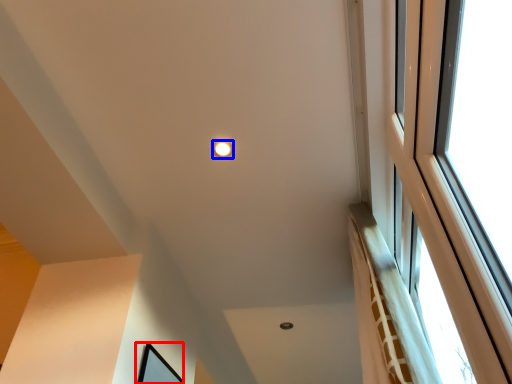
Question: Which of the following is the farthest to the observer, picture frame (highlighted by a red box) or lighting (highlighted by a blue box)?

Choices:
 (A) picture frame
 (B) lighting

Answer: (B)